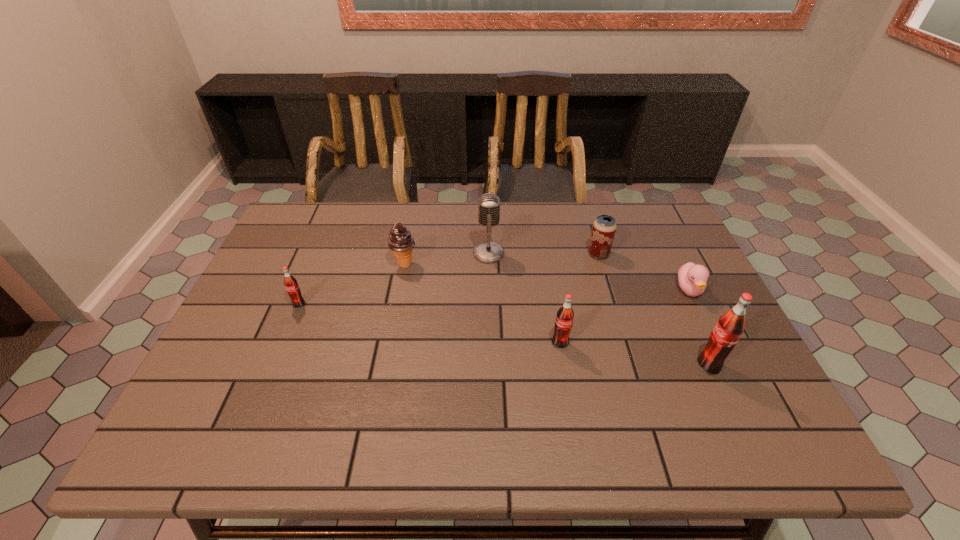
The image size is (960, 540). Identify the location of microphone present at the far edge. (488, 252).

The height and width of the screenshot is (540, 960). Find the location of `object at the near edge`. object at the near edge is located at coordinates (730, 326).

You are a GUI agent. You are given a task and a screenshot of the screen. Output one action in this format:
    pyautogui.click(x=<x>, y=<y>)
    Task: Click on the object present at the left edge
    The height and width of the screenshot is (540, 960).
    Given the screenshot: What is the action you would take?
    pyautogui.click(x=291, y=285)

The height and width of the screenshot is (540, 960). I want to click on soda bottle that is at the right edge, so click(x=730, y=326).

Where is `duckling located at the right edge`? Image resolution: width=960 pixels, height=540 pixels. duckling located at the right edge is located at coordinates (692, 278).

Where is `object that is at the near right corner`? Image resolution: width=960 pixels, height=540 pixels. object that is at the near right corner is located at coordinates (730, 326).

In the image, there is a desktop. At what (x,y) coordinates should I click in order to perform the action: click on vacant area at the far edge. Please return your answer as a coordinate pair (x, y). The width and height of the screenshot is (960, 540). Looking at the image, I should click on (456, 239).

The height and width of the screenshot is (540, 960). Find the location of `free spot at the near edge of the desktop`. free spot at the near edge of the desktop is located at coordinates (646, 393).

Image resolution: width=960 pixels, height=540 pixels. Identify the location of free space at the left edge of the desktop. 272,257.

I want to click on free region at the right edge, so click(660, 260).